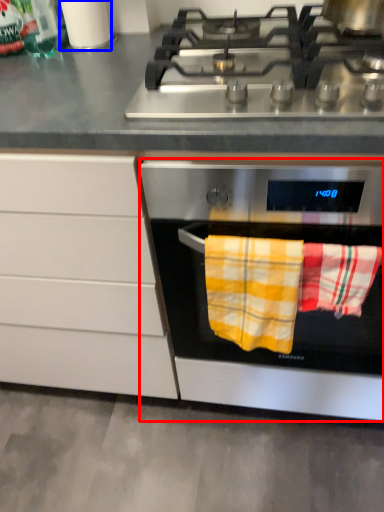
Question: Among these objects, which one is farthest to the camera, oven (highlighted by a red box) or appliance (highlighted by a blue box)?

Choices:
 (A) oven
 (B) appliance

Answer: (B)